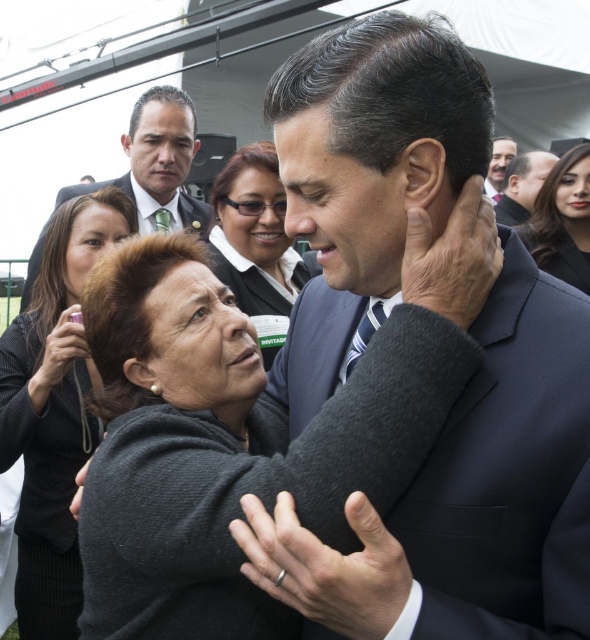
Which is above, dark blue suit at center or dark gray sweater at lower left?

dark blue suit at center is higher up.

Is dark blue suit at center to the right of dark gray sweater at lower left from the viewer's perspective?

Correct, you'll find dark blue suit at center to the right of dark gray sweater at lower left.

Which is in front, point (532, 596) or point (70, 584)?

Point (532, 596) is more forward.

What are the coordinates of `dark blue suit at center` in the screenshot? It's located at (467, 497).

Which is behind, point (175, 228) or point (496, 141)?

The point (496, 141) is behind.

Is matte black suit at upper center shorter than smooth brown hair at upper right?

No, matte black suit at upper center is not shorter than smooth brown hair at upper right.

Locate an element on the screen. matte black suit at upper center is located at coordinates (158, 161).

Where is `matte black suit at upper center`? This screenshot has width=590, height=640. matte black suit at upper center is located at coordinates (158, 161).

Looking at this image, who is more forward, (x=572, y=330) or (x=556, y=157)?

Positioned in front is point (x=572, y=330).

Where is `dark blue suit at center`? dark blue suit at center is located at coordinates (467, 497).